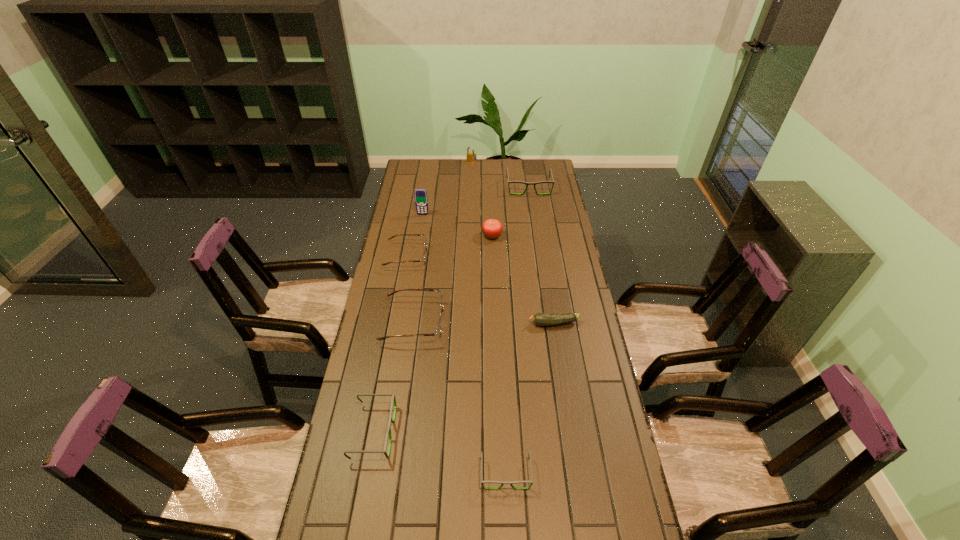
Image resolution: width=960 pixels, height=540 pixels. What are the coordinates of `the second smallest black spectacles` in the screenshot? It's located at point(393,400).

At what (x,y) coordinates should I click in order to perform the action: click on the second farthest spectacles. Please return your answer as a coordinate pair (x, y). Looking at the image, I should click on (423, 260).

Image resolution: width=960 pixels, height=540 pixels. Find the location of `the fifth nearest object`. the fifth nearest object is located at coordinates [x=423, y=260].

Image resolution: width=960 pixels, height=540 pixels. Find the location of `green zucchini`. green zucchini is located at coordinates (541, 319).

The width and height of the screenshot is (960, 540). I want to click on the shortest spectacles, so click(x=502, y=483).

This screenshot has width=960, height=540. In order to click on free spot located 0.350m on the front-facing side of the third farthest object in this screenshot , I will do `click(415, 265)`.

The height and width of the screenshot is (540, 960). Identify the location of vacant space located 0.060m on the side with the combination dials of the farthest object. (471, 170).

Find the location of `vacant space positioned 0.350m on the back of the sixth nearest object`. vacant space positioned 0.350m on the back of the sixth nearest object is located at coordinates (491, 187).

The height and width of the screenshot is (540, 960). In order to click on free point located 0.370m on the lens of the farthest spectacles in this screenshot , I will do `click(537, 242)`.

Identify the location of vacant region located on the front-facing side of the third farthest spectacles. click(529, 322).